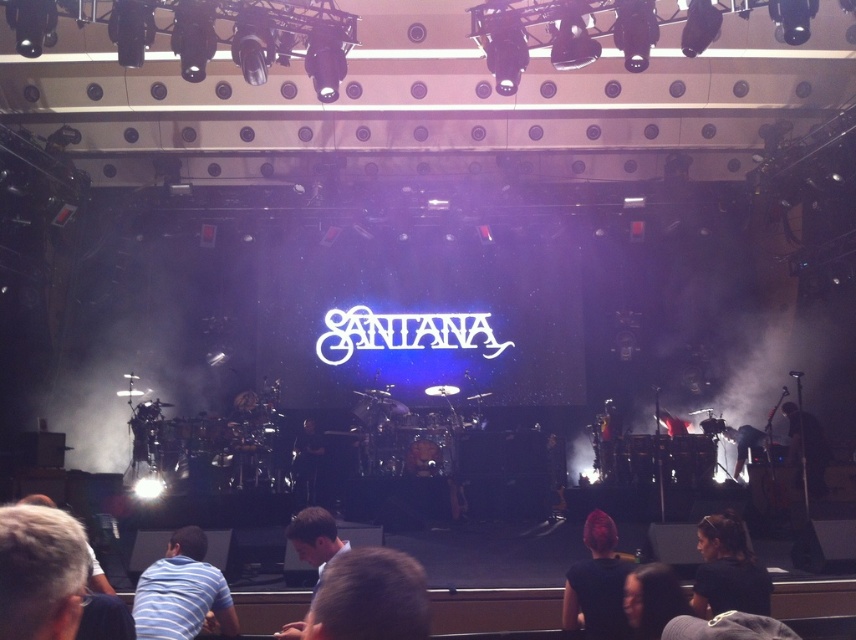
You are a photographer at the Santana concert. You need to capture a photo of both the pink hair at center and the black leather guitar at center. Based on their positions, which object should you focus on first to ensure both are in the frame?

The pink hair at center is positioned over the black leather guitar at center, so focusing on the pink hair at center first will ensure both objects are captured in the frame.

You are a photographer at the concert and want to capture a photo that includes both the pink hair at center and the dark brown hair at lower center. Based on their positions, which hair color should you focus on first to ensure both are in the frame?

The pink hair at center is positioned on the left side of dark brown hair at lower center. To include both in the frame, focus on the pink hair at center first as it is on the left, then adjust to include the dark brown hair at lower center on the right.